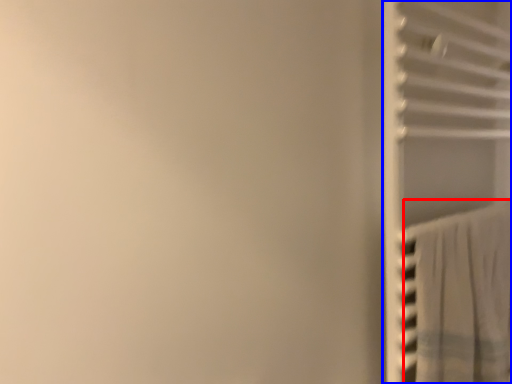
Question: Which of the following is the closest to the observer, curtain (highlighted by a red box) or closet (highlighted by a blue box)?

Choices:
 (A) curtain
 (B) closet

Answer: (B)